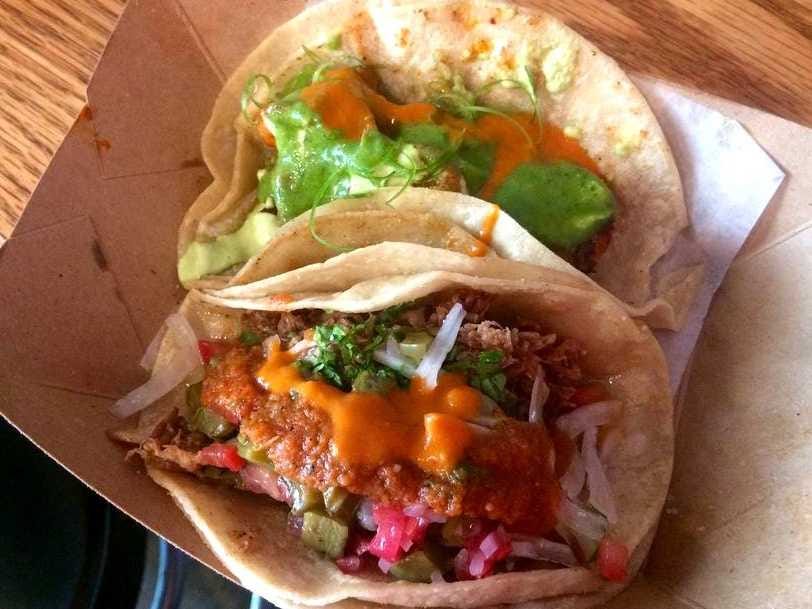
Identify the location of wooden table. (15, 69), (744, 25).